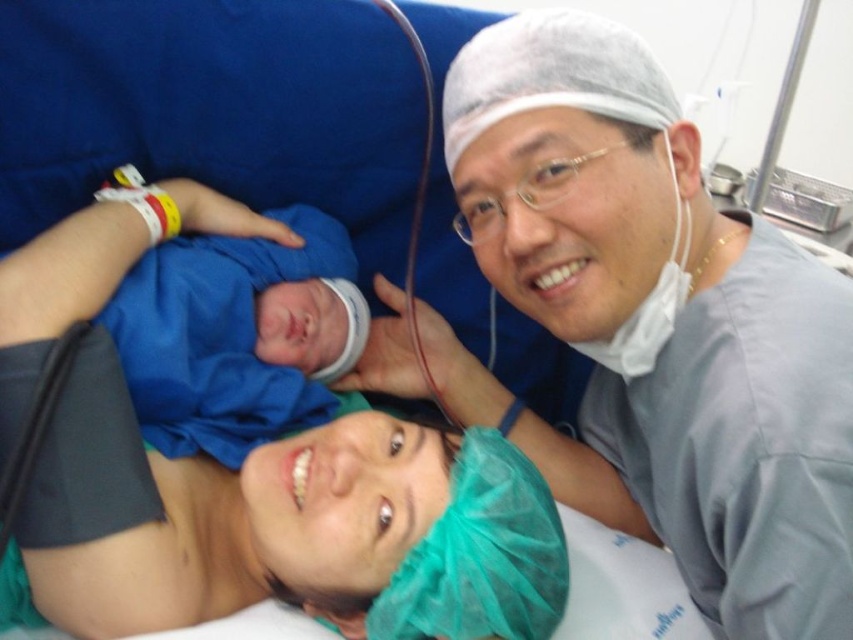
You are a medical student observing the scene and need to identify which point is closer to you. The points are point 1 at coordinates point (676, 557) and point 2 at coordinates point (196, 349). Which point is closer to you?

Point (676, 557) is further to the viewer than point (196, 349), so point (196, 349) is closer to you.

You are a nurse in the hospital and need to locate the gray scrubs at upper right. Where exactly are they positioned in the image?

The gray scrubs at upper right are positioned at the 2D coordinates point (654,324).

You are a medical student observing a postpartum care scene. You need to hand a medical tool to the adult in gray scrubs at upper right and then retrieve a swaddle from the blue fabric swaddle at center. Which task should you perform first to minimize moving around?

You should hand the medical tool to the gray scrubs at upper right first because they are closer to you than the blue fabric swaddle at center, making it more efficient to complete the tasks in that order.